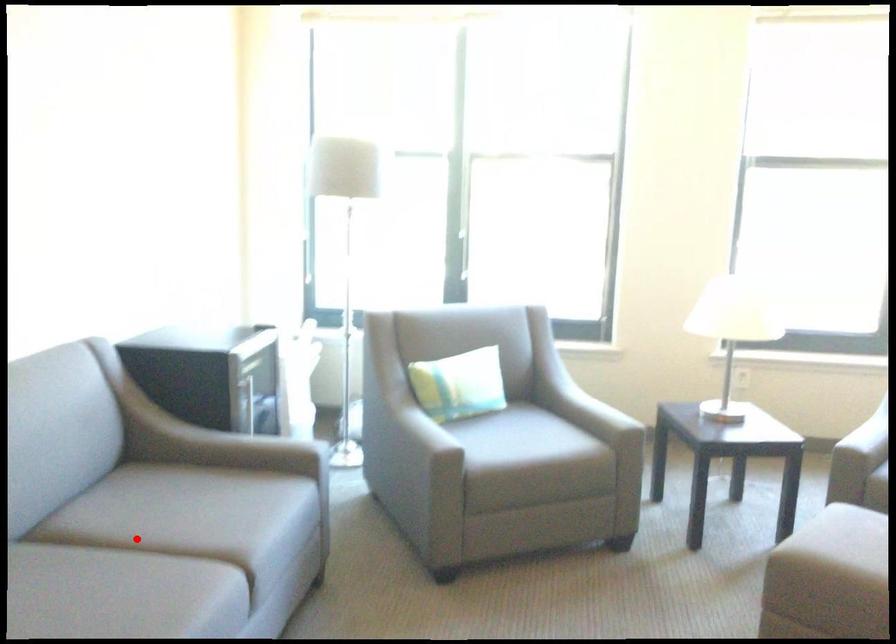
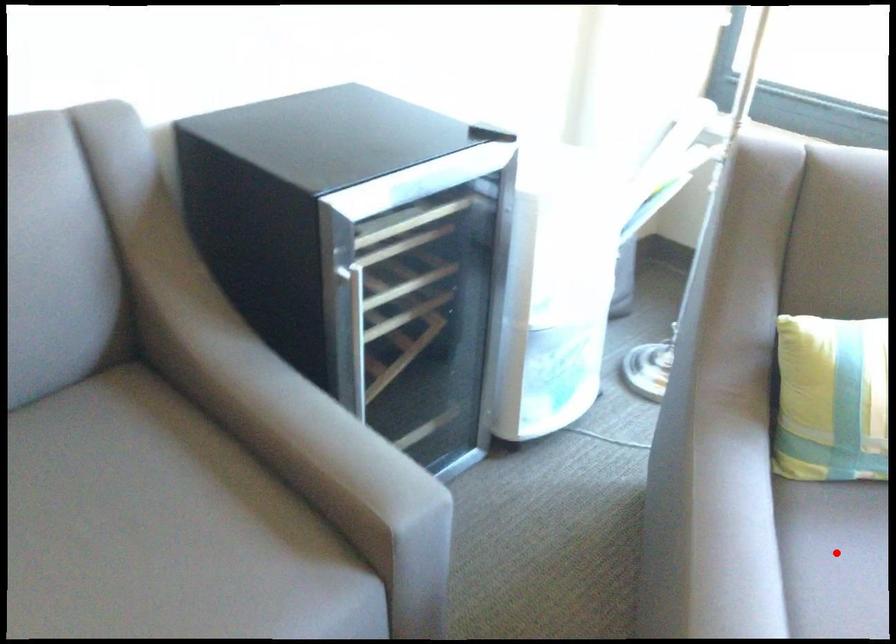
I am providing you with two images of the same scene from different viewpoints. A red point is marked on the first image and another point is marked on the second image. Does the point marked in image1 correspond to the same location as the one in image2?

No